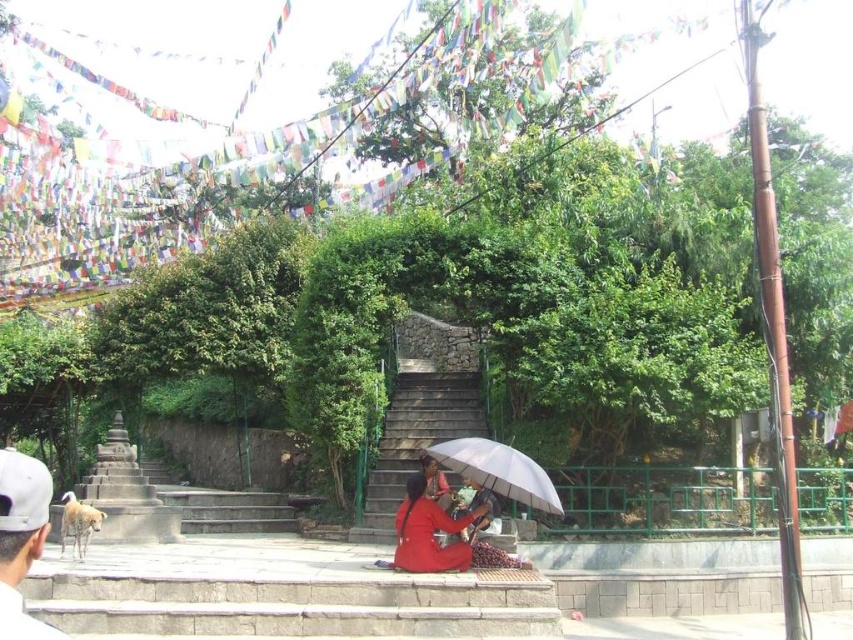
Does transparent plastic umbrella at center appear under red fabric umbrella at lower center?

No, transparent plastic umbrella at center is not below red fabric umbrella at lower center.

Identify the location of transparent plastic umbrella at center. Image resolution: width=853 pixels, height=640 pixels. click(x=498, y=470).

Is stone stairs at center wider than red fabric umbrella at lower center?

Indeed, stone stairs at center has a greater width compared to red fabric umbrella at lower center.

The width and height of the screenshot is (853, 640). I want to click on stone stairs at center, so click(x=415, y=440).

At what (x,y) coordinates should I click in order to perform the action: click on stone stairs at center. Please return your answer as a coordinate pair (x, y). Image resolution: width=853 pixels, height=640 pixels. Looking at the image, I should click on (415, 440).

Identify the location of stone stairs at center. This screenshot has width=853, height=640. (415, 440).

Does point (16, 493) come farther from viewer compared to point (485, 506)?

No, it is not.

Which is in front, point (4, 579) or point (422, 524)?

Point (4, 579) is in front.

The image size is (853, 640). Describe the element at coordinates (21, 540) in the screenshot. I see `white cap at lower left` at that location.

Locate an element on the screen. The width and height of the screenshot is (853, 640). white cap at lower left is located at coordinates (21, 540).